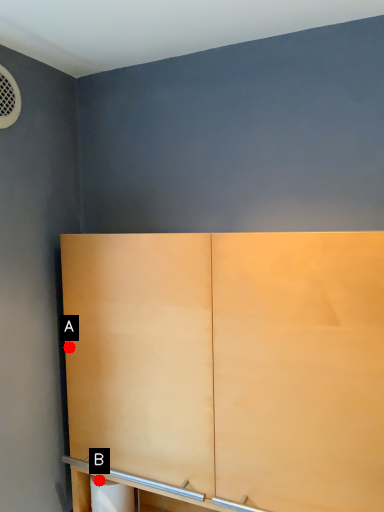
Question: Two points are circled on the image, labeled by A and B beside each circle. Among these points, which one is nearest to the camera?

Choices:
 (A) A is closer
 (B) B is closer

Answer: (B)